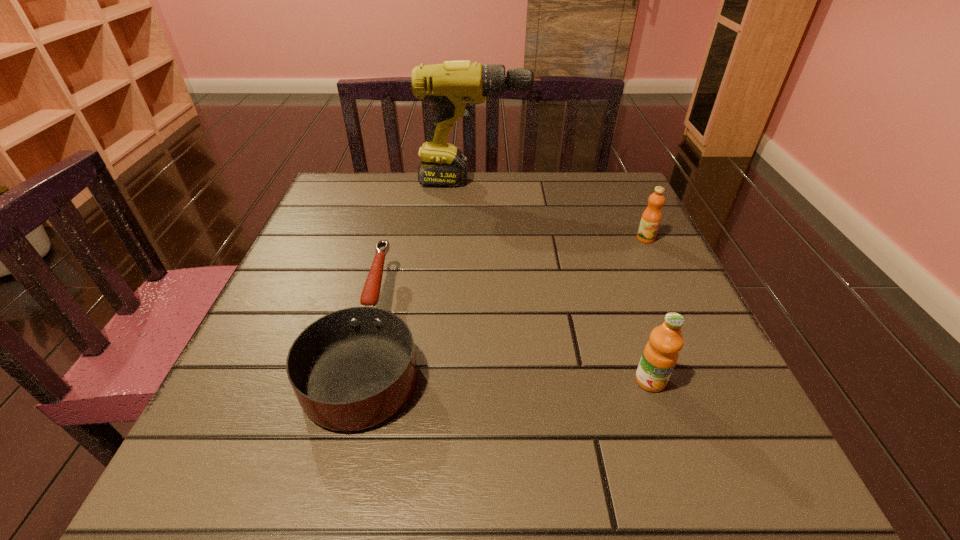
Where is `blank space at the far right corner of the desktop`? Image resolution: width=960 pixels, height=540 pixels. blank space at the far right corner of the desktop is located at coordinates (622, 173).

At what (x,y) coordinates should I click in order to perform the action: click on free space between the rightmost object and the shortest object. Please return your answer as a coordinate pair (x, y). The image size is (960, 540). Looking at the image, I should click on (509, 287).

Find the location of a particular element. free space between the farthest object and the right orange juice is located at coordinates (561, 210).

This screenshot has height=540, width=960. Find the location of `free point between the right orange juice and the farthest object`. free point between the right orange juice and the farthest object is located at coordinates (561, 210).

The height and width of the screenshot is (540, 960). Find the location of `free space between the right orange juice and the third object from left to right`. free space between the right orange juice and the third object from left to right is located at coordinates (648, 309).

Find the location of a particular element. free point between the right orange juice and the pan is located at coordinates (509, 287).

Where is `vacant area that lies between the second farthest object and the farthest object`? Image resolution: width=960 pixels, height=540 pixels. vacant area that lies between the second farthest object and the farthest object is located at coordinates (561, 210).

Identify the location of empty location between the farther orange juice and the pan. Image resolution: width=960 pixels, height=540 pixels. (509, 287).

The height and width of the screenshot is (540, 960). I want to click on empty space between the tallest object and the nearer orange juice, so click(x=563, y=281).

Find the location of a particular element. Image resolution: width=960 pixels, height=540 pixels. empty space that is in between the shortest object and the tallest object is located at coordinates (423, 259).